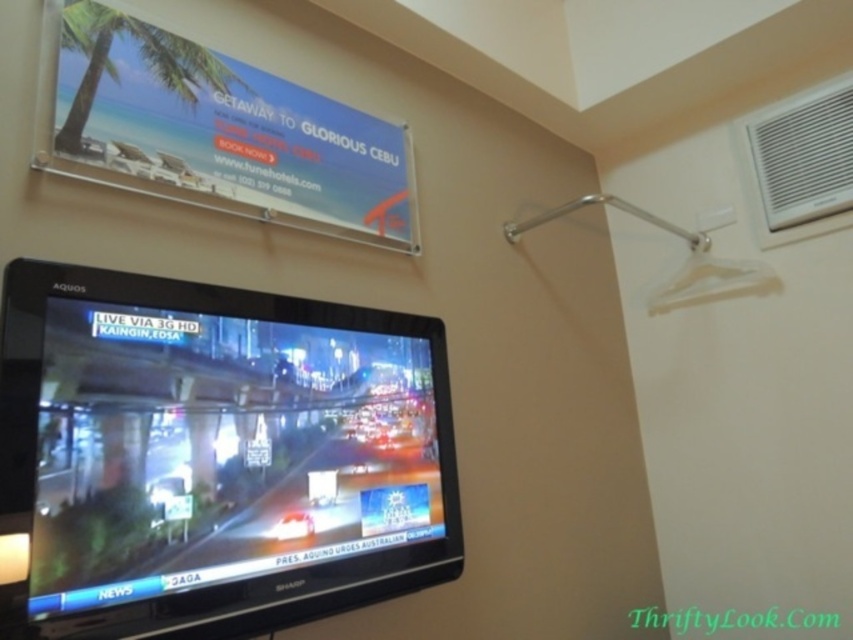
Question: Which point is closer to the camera taking this photo?

Choices:
 (A) (135, 412)
 (B) (723, 282)

Answer: (A)

Question: Among these points, which one is nearest to the camera?

Choices:
 (A) (746, 264)
 (B) (218, 413)

Answer: (B)

Question: Can you confirm if black glossy tv at center is smaller than clear plastic hanger at upper right?

Choices:
 (A) yes
 (B) no

Answer: (B)

Question: In this image, where is black glossy tv at center located relative to clear plastic hanger at upper right?

Choices:
 (A) left
 (B) right

Answer: (A)

Question: Is black glossy tv at center bigger than clear plastic hanger at upper right?

Choices:
 (A) no
 (B) yes

Answer: (B)

Question: Which object appears closest to the camera in this image?

Choices:
 (A) clear plastic hanger at upper right
 (B) black glossy tv at center

Answer: (B)